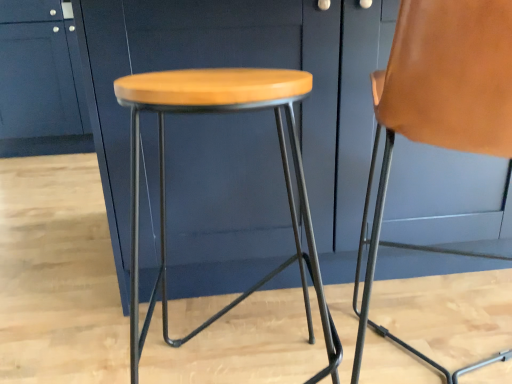
Question: Considering the positions of matte blue cabinet at center, arranged as the first cabinetry when viewed from the right, and matte blue cabinet at upper left, the first cabinetry when ordered from left to right, in the image, is matte blue cabinet at center, arranged as the first cabinetry when viewed from the right, wider or thinner than matte blue cabinet at upper left, the first cabinetry when ordered from left to right,?

Choices:
 (A) wide
 (B) thin

Answer: (A)

Question: From the image's perspective, is matte blue cabinet at center, acting as the second cabinetry starting from the left, located above or below matte blue cabinet at upper left, positioned as the first cabinetry in back-to-front order?

Choices:
 (A) below
 (B) above

Answer: (A)

Question: Which is nearer to the wooden seat stool at center?

Choices:
 (A) matte blue cabinet at upper left, the first cabinetry when ordered from left to right
 (B) matte blue cabinet at center, acting as the second cabinetry starting from the left
 (C) brown leather chair at right

Answer: (B)

Question: Estimate the real-world distances between objects in this image. Which object is closer to the matte blue cabinet at center, the first cabinetry when ordered from front to back?

Choices:
 (A) wooden seat stool at center
 (B) brown leather chair at right
 (C) matte blue cabinet at upper left, positioned as the first cabinetry in back-to-front order

Answer: (A)